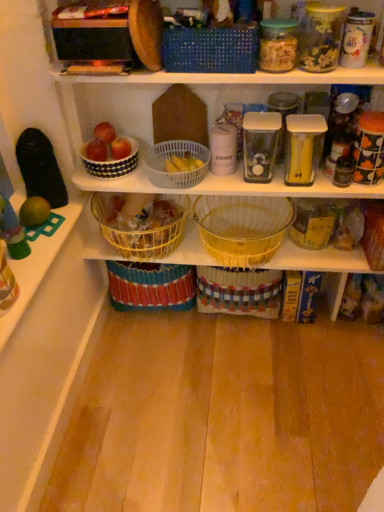
At what (x,y) coordinates should I click in order to perform the action: click on vacant area that is in front of red matte apple at upper left, positioned as the 1th apple in left-to-right order. Please return your answer as a coordinate pair (x, y). The image size is (384, 512). Looking at the image, I should click on coord(107,175).